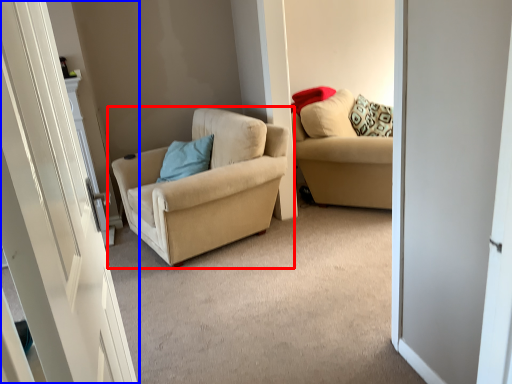
Question: Which object is closer to the camera taking this photo, chair (highlighted by a red box) or door (highlighted by a blue box)?

Choices:
 (A) chair
 (B) door

Answer: (B)